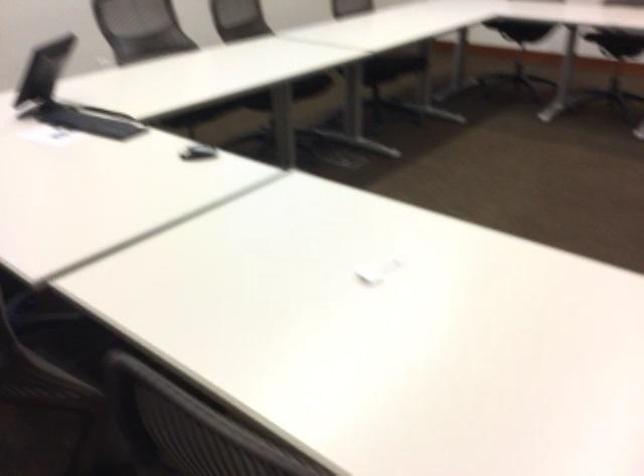
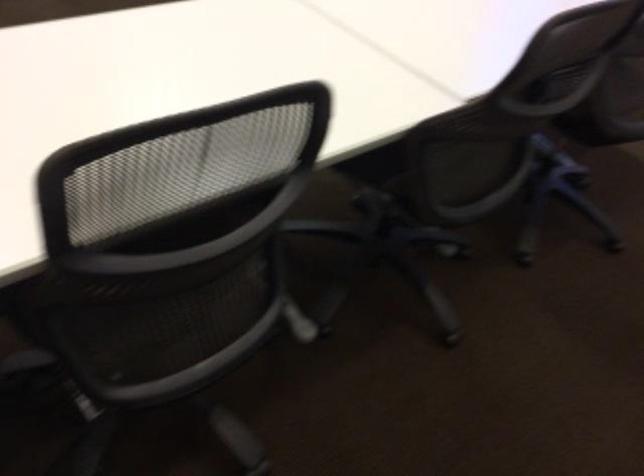
Question: In a continuous first-person perspective shot, in which direction is the camera moving?

Choices:
 (A) Left
 (B) Right
 (C) Forward
 (D) Backward

Answer: (D)